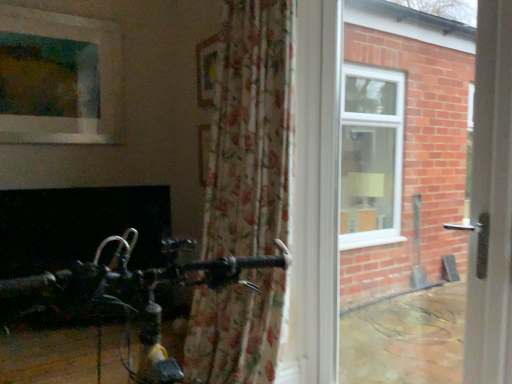
Question: Based on their positions, is matte glass window at upper left located to the left or right of wooden frame at upper center?

Choices:
 (A) right
 (B) left

Answer: (B)

Question: Considering the positions of matte glass window at upper left and wooden frame at upper center in the image, is matte glass window at upper left taller or shorter than wooden frame at upper center?

Choices:
 (A) tall
 (B) short

Answer: (A)

Question: Which object is positioned closest to the wooden frame at upper center?

Choices:
 (A) matte glass window at upper left
 (B) transparent plastic screen door at right
 (C) white plastic door handle at right
 (D) floral fabric curtain at center

Answer: (A)

Question: Which is nearer to the matte glass window at upper left?

Choices:
 (A) white plastic door handle at right
 (B) wooden frame at upper center
 (C) transparent plastic screen door at right
 (D) floral fabric curtain at center

Answer: (B)